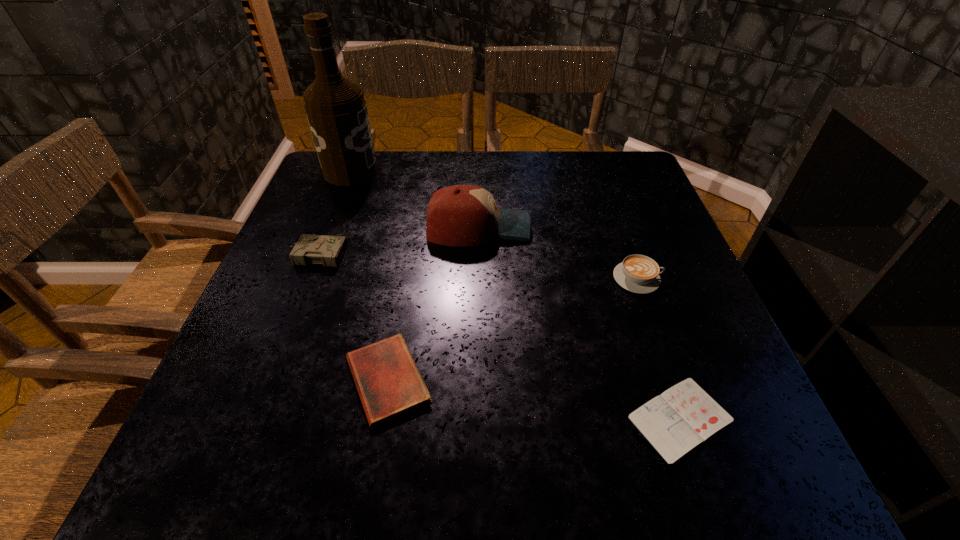
In order to click on vacant space located on the label of the tallest object in this screenshot , I will do `click(474, 171)`.

Identify the location of vacant space situated on the front-facing side of the baseball cap. The width and height of the screenshot is (960, 540). (652, 228).

Find the location of a particular element. free location located on the back of the leftmost diary is located at coordinates (332, 213).

Find the location of a particular element. This screenshot has height=540, width=960. free region located on the back of the second shortest diary is located at coordinates (410, 249).

This screenshot has width=960, height=540. Find the location of `free location located 0.120m on the left of the rightmost diary`. free location located 0.120m on the left of the rightmost diary is located at coordinates (554, 418).

Where is `object present at the far edge`? object present at the far edge is located at coordinates (336, 110).

The width and height of the screenshot is (960, 540). In order to click on object situated at the near edge in this screenshot , I will do `click(682, 417)`.

At what (x,y) coordinates should I click in order to perform the action: click on alcohol that is at the left edge. Please return your answer as a coordinate pair (x, y). This screenshot has height=540, width=960. Looking at the image, I should click on (336, 110).

Locate an element on the screen. diary that is at the left edge is located at coordinates (310, 249).

You are a GUI agent. You are given a task and a screenshot of the screen. Output one action in this format:
    pyautogui.click(x=<x>, y=<y>)
    Task: Click on the cappuccino positioned at the right edge
    This screenshot has width=960, height=540.
    Given the screenshot: What is the action you would take?
    pyautogui.click(x=637, y=273)